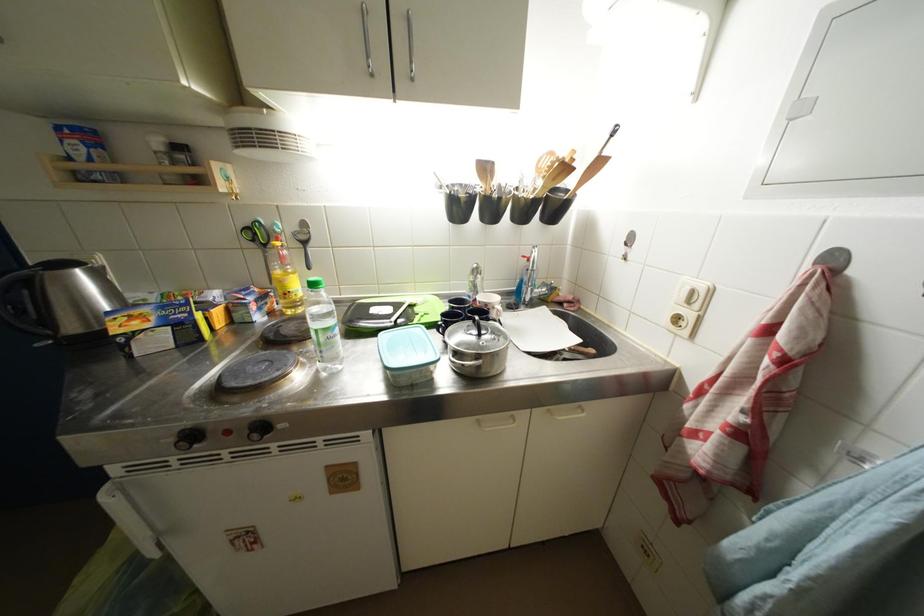
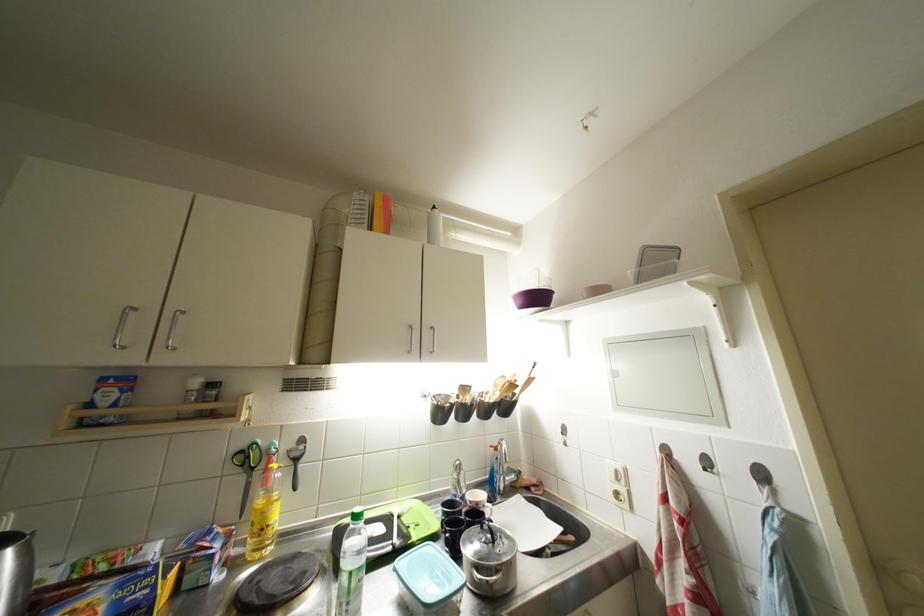
Find the pixel in the second image that matches point 481,291 in the first image.

(466, 487)